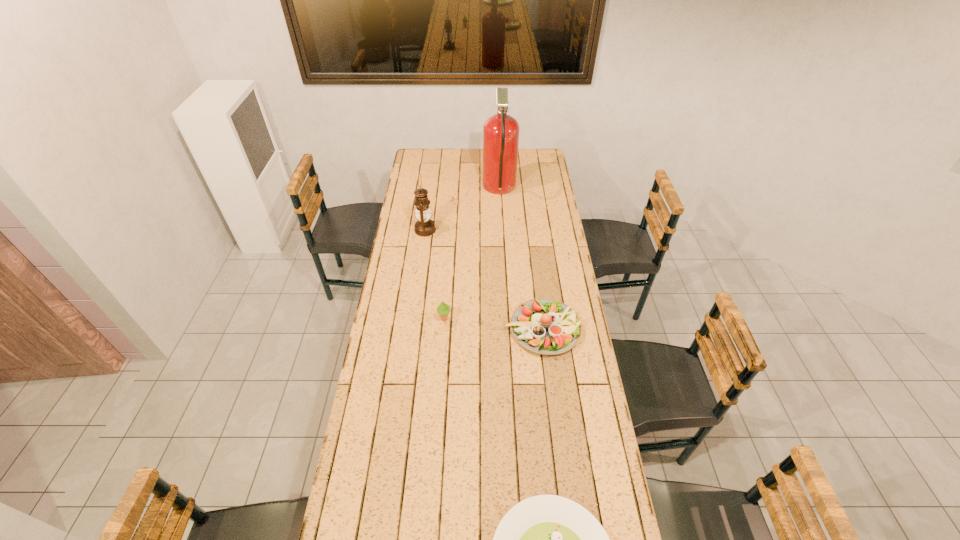
Identify the location of the farthest object. The image size is (960, 540). (500, 132).

You are a GUI agent. You are given a task and a screenshot of the screen. Output one action in this format:
    pyautogui.click(x=<x>, y=<y>)
    Task: Click on the tallest object
    
    Given the screenshot: What is the action you would take?
    pyautogui.click(x=500, y=132)

You are a GUI agent. You are given a task and a screenshot of the screen. Output one action in this format:
    pyautogui.click(x=<x>, y=<y>)
    Task: Click on the second tallest object
    The height and width of the screenshot is (540, 960).
    Given the screenshot: What is the action you would take?
    pyautogui.click(x=424, y=227)

Locate an element on the screen. The image size is (960, 540). oil lamp is located at coordinates (424, 227).

I want to click on the third tallest object, so click(x=443, y=309).

What are the coordinates of `icecream` in the screenshot? It's located at (443, 309).

Find the location of a particular element. Image resolution: width=960 pixels, height=540 pixels. the fourth tallest object is located at coordinates (544, 326).

Where is `the farther salad plate`? This screenshot has width=960, height=540. the farther salad plate is located at coordinates click(544, 326).

Where is `vacant space situated 0.060m with the handle and nozzle on the farthest object`? The image size is (960, 540). vacant space situated 0.060m with the handle and nozzle on the farthest object is located at coordinates (471, 190).

Where is `free space located with the handle and nozzle on the farthest object`? The image size is (960, 540). free space located with the handle and nozzle on the farthest object is located at coordinates (437, 190).